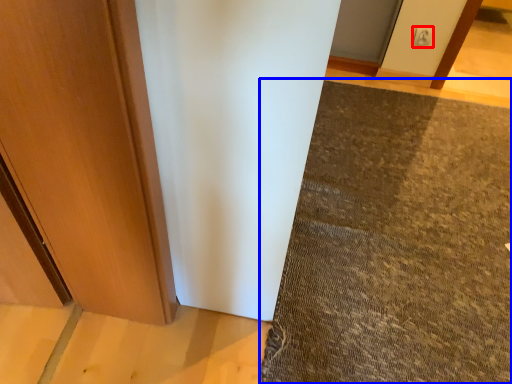
Question: Which object is further to the camera taking this photo, electric outlet (highlighted by a red box) or mat (highlighted by a blue box)?

Choices:
 (A) electric outlet
 (B) mat

Answer: (A)